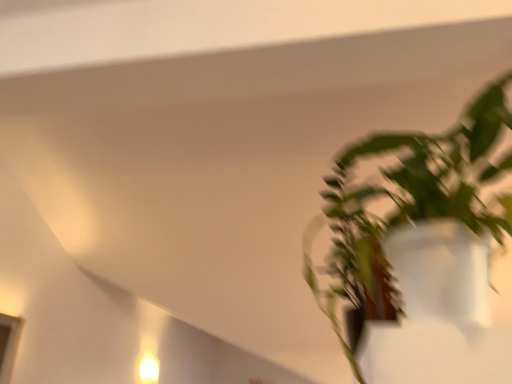
Question: From the image's perspective, is green matte plant at right located above or below white glossy light fixture at lower left?

Choices:
 (A) above
 (B) below

Answer: (A)

Question: Is green matte plant at right bigger or smaller than white glossy light fixture at lower left?

Choices:
 (A) small
 (B) big

Answer: (B)

Question: Looking at their shapes, would you say green matte plant at right is wider or thinner than white glossy light fixture at lower left?

Choices:
 (A) thin
 (B) wide

Answer: (B)

Question: From a real-world perspective, is white glossy light fixture at lower left positioned above or below green matte plant at right?

Choices:
 (A) above
 (B) below

Answer: (B)

Question: Is white glossy light fixture at lower left bigger or smaller than green matte plant at right?

Choices:
 (A) big
 (B) small

Answer: (B)

Question: Visually, is white glossy light fixture at lower left positioned to the left or to the right of green matte plant at right?

Choices:
 (A) left
 (B) right

Answer: (A)

Question: Is white glossy light fixture at lower left in front of or behind green matte plant at right in the image?

Choices:
 (A) behind
 (B) front

Answer: (A)